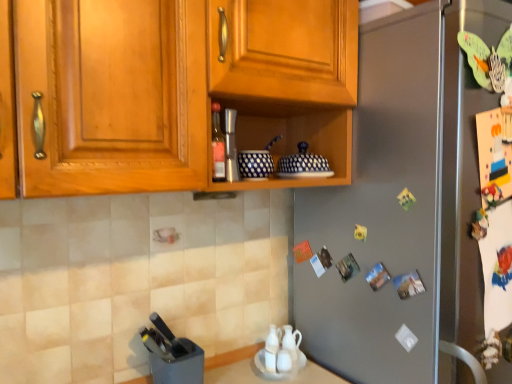
Question: Does black plastic knife block at lower left, marked as the 3th appliance in a top-to-bottom arrangement, have a lesser height compared to blue dotted ceramic bowls at center, which ranks as the second appliance in bottom-to-top order?

Choices:
 (A) no
 (B) yes

Answer: (A)

Question: Could you tell me if black plastic knife block at lower left, acting as the first appliance starting from the bottom, is facing blue dotted ceramic bowls at center, the 3th appliance positioned from the left?

Choices:
 (A) yes
 (B) no

Answer: (B)

Question: Is blue dotted ceramic bowls at center, the 3th appliance positioned from the left, inside black plastic knife block at lower left, arranged as the first appliance when viewed from the left?

Choices:
 (A) no
 (B) yes

Answer: (A)

Question: Is black plastic knife block at lower left, acting as the first appliance starting from the bottom, next to blue dotted ceramic bowls at center, which ranks as the second appliance in bottom-to-top order, and touching it?

Choices:
 (A) no
 (B) yes

Answer: (A)

Question: From a real-world perspective, is black plastic knife block at lower left, which ranks as the 3th appliance in right-to-left order, located higher than blue dotted ceramic bowls at center, which ranks as the second appliance in bottom-to-top order?

Choices:
 (A) no
 (B) yes

Answer: (A)

Question: From the image's perspective, is wooden cabinet at upper center positioned above or below satin silver refrigerator at center?

Choices:
 (A) below
 (B) above

Answer: (B)

Question: In terms of height, does wooden cabinet at upper center look taller or shorter compared to satin silver refrigerator at center?

Choices:
 (A) short
 (B) tall

Answer: (A)

Question: Looking at their shapes, would you say wooden cabinet at upper center is wider or thinner than satin silver refrigerator at center?

Choices:
 (A) wide
 (B) thin

Answer: (B)

Question: Considering the relative positions of wooden cabinet at upper center and satin silver refrigerator at center in the image provided, is wooden cabinet at upper center to the left or to the right of satin silver refrigerator at center?

Choices:
 (A) right
 (B) left

Answer: (B)

Question: Based on their sizes in the image, would you say matte glass bottle at center is bigger or smaller than brushed metal shaker at center, marked as the third appliance in a bottom-to-top arrangement?

Choices:
 (A) big
 (B) small

Answer: (B)

Question: Is point (212, 145) closer or farther from the camera than point (229, 168)?

Choices:
 (A) closer
 (B) farther

Answer: (A)

Question: Is matte glass bottle at center spatially inside brushed metal shaker at center, arranged as the 2th appliance when viewed from the right, or outside of it?

Choices:
 (A) outside
 (B) inside

Answer: (A)

Question: Relative to brushed metal shaker at center, the first appliance positioned from the top, is matte glass bottle at center in front or behind?

Choices:
 (A) front
 (B) behind

Answer: (A)

Question: In terms of width, does black plastic knife block at lower left, acting as the first appliance starting from the bottom, look wider or thinner when compared to wooden cabinet at upper center?

Choices:
 (A) thin
 (B) wide

Answer: (A)

Question: Relative to wooden cabinet at upper center, is black plastic knife block at lower left, which ranks as the 3th appliance in right-to-left order, in front or behind?

Choices:
 (A) front
 (B) behind

Answer: (B)